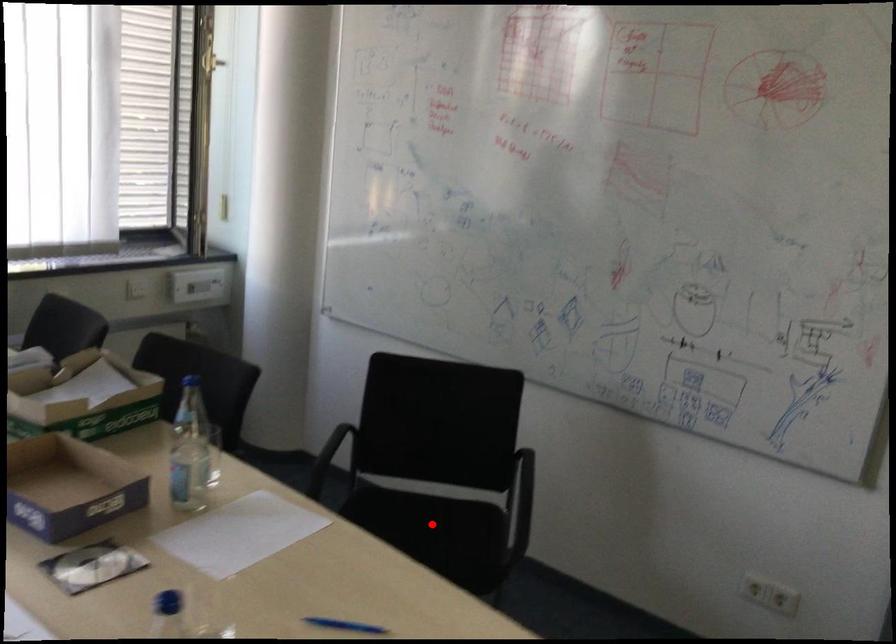
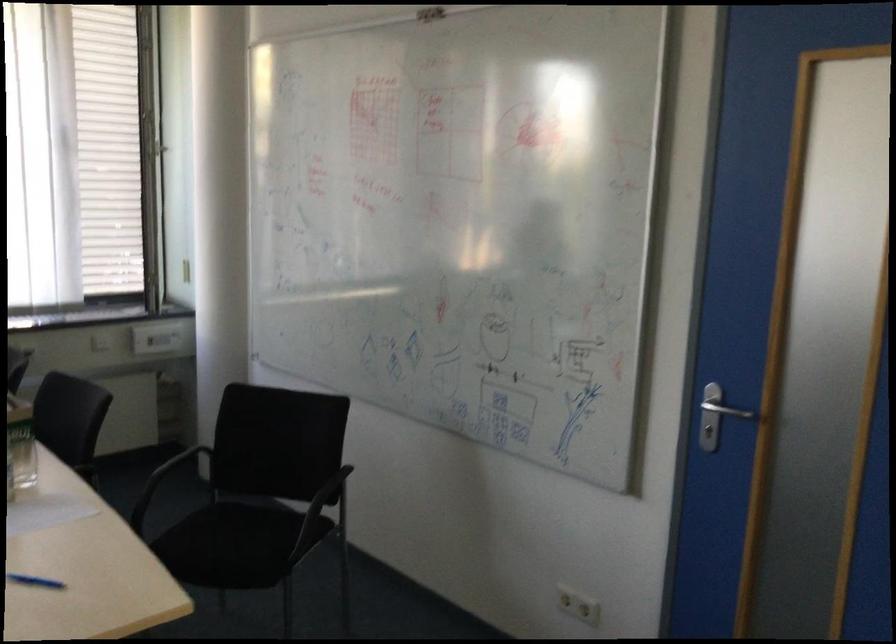
Locate, in the second image, the point that corresponds to the highlighted location in the first image.

(251, 529)